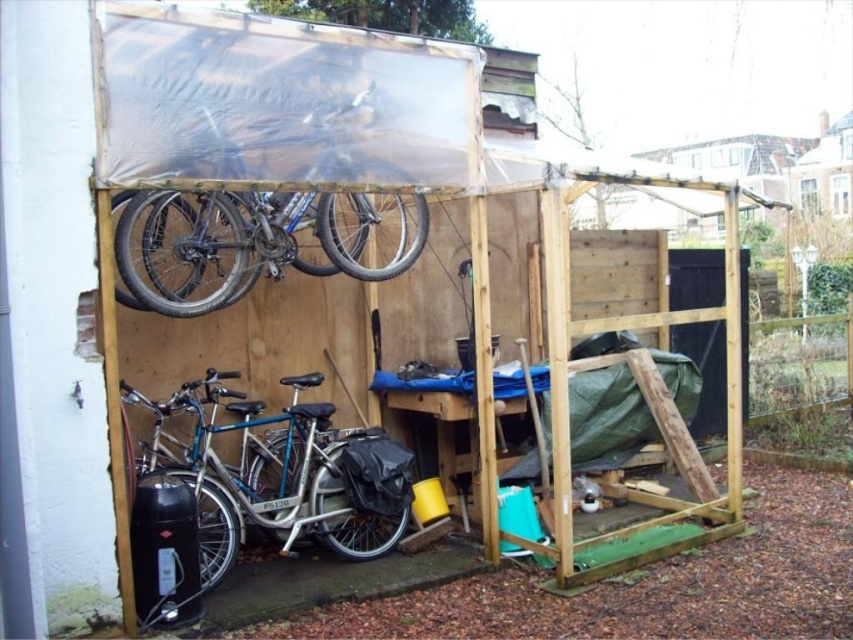
Which is more to the right, silver metallic bicycle at lower left or shiny metallic bicycle at upper center?

shiny metallic bicycle at upper center is more to the right.

Is silver metallic bicycle at lower left positioned in front of shiny metallic bicycle at upper center?

No, silver metallic bicycle at lower left is behind shiny metallic bicycle at upper center.

Is point (329, 428) more distant than point (415, 211)?

That is False.

Where is `silver metallic bicycle at lower left`? This screenshot has width=853, height=640. silver metallic bicycle at lower left is located at coordinates (280, 474).